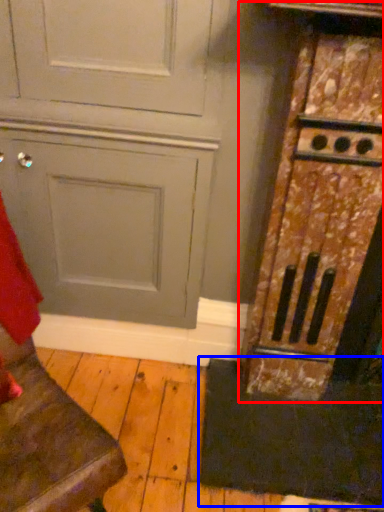
Question: Which object appears closest to the camera in this image, cabinetry (highlighted by a red box) or doormat (highlighted by a blue box)?

Choices:
 (A) cabinetry
 (B) doormat

Answer: (A)